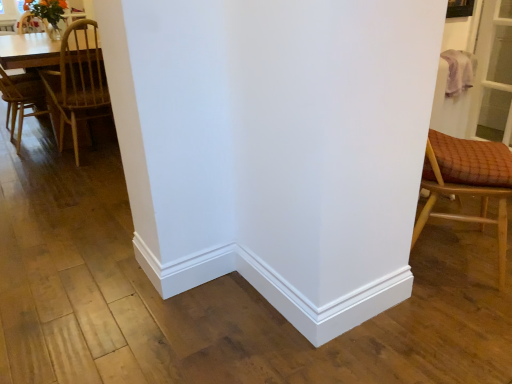
Question: Considering the positions of point (48, 41) and point (59, 129), is point (48, 41) closer or farther from the camera than point (59, 129)?

Choices:
 (A) closer
 (B) farther

Answer: (A)

Question: Considering the relative positions of light brown wooden table at left and wooden chair at left, placed as the 2th chair when sorted from front to back, in the image provided, is light brown wooden table at left to the left or to the right of wooden chair at left, placed as the 2th chair when sorted from front to back,?

Choices:
 (A) left
 (B) right

Answer: (A)

Question: Estimate the real-world distances between objects in this image. Which object is closer to the wooden chair at left, positioned as the 1th chair in left-to-right order?

Choices:
 (A) wooden checkered cushion at right, marked as the second chair in a left-to-right arrangement
 (B) light brown wooden table at left

Answer: (B)

Question: Estimate the real-world distances between objects in this image. Which object is closer to the wooden chair at left, marked as the first chair in a back-to-front arrangement?

Choices:
 (A) light brown wooden table at left
 (B) wooden checkered cushion at right, marked as the second chair in a left-to-right arrangement

Answer: (A)